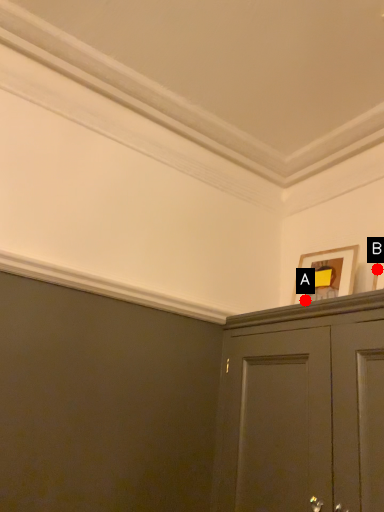
Question: Two points are circled on the image, labeled by A and B beside each circle. Which point is closer to the camera?

Choices:
 (A) A is closer
 (B) B is closer

Answer: (B)